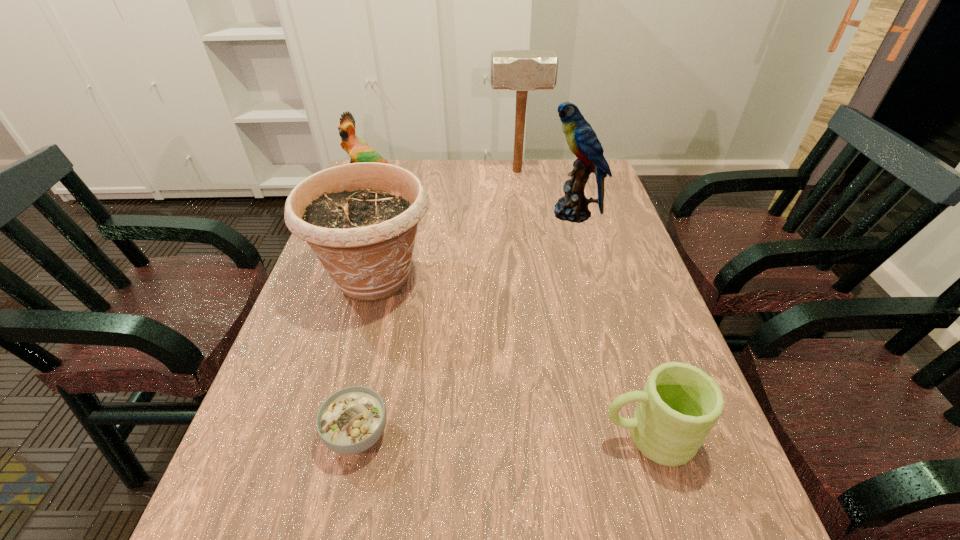
At what (x,y) coordinates should I click in order to perform the action: click on vacant space located 0.290m on the face of the taller parrot. Please return your answer as a coordinate pair (x, y). The width and height of the screenshot is (960, 540). Looking at the image, I should click on (451, 213).

Locate an element on the screen. free spot located 0.250m on the face of the taller parrot is located at coordinates (465, 213).

I want to click on vacant space situated 0.260m on the face of the taller parrot, so click(462, 213).

You are a GUI agent. You are given a task and a screenshot of the screen. Output one action in this format:
    pyautogui.click(x=<x>, y=<y>)
    Task: Click on the blank space located on the front-facing side of the left parrot
    The height and width of the screenshot is (540, 960).
    Given the screenshot: What is the action you would take?
    pyautogui.click(x=361, y=219)

You are a GUI agent. You are given a task and a screenshot of the screen. Output one action in this format:
    pyautogui.click(x=<x>, y=<y>)
    Task: Click on the vacant region located on the front of the flowerpot
    
    Given the screenshot: What is the action you would take?
    pyautogui.click(x=324, y=464)

What are the coordinates of `free space located on the side of the mug with the handle` in the screenshot? It's located at (540, 436).

The width and height of the screenshot is (960, 540). What are the coordinates of `vacant space located 0.050m on the side of the mug with the handle` in the screenshot? It's located at (572, 436).

The image size is (960, 540). I want to click on vacant area located 0.200m on the side of the mug with the handle, so pos(491,436).

You are a GUI agent. You are given a task and a screenshot of the screen. Output one action in this format:
    pyautogui.click(x=<x>, y=<y>)
    Task: Click on the blank space located 0.230m on the right of the soup bowl
    This screenshot has width=960, height=540.
    Given the screenshot: What is the action you would take?
    pos(515,434)

The height and width of the screenshot is (540, 960). What are the coordinates of `mallet situated at the far edge` in the screenshot? It's located at (521, 70).